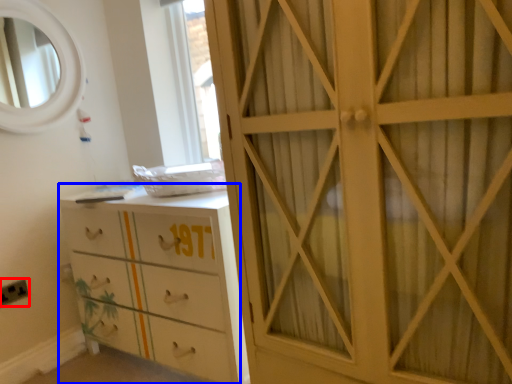
Question: Which object appears farthest to the camera in this image, electric outlet (highlighted by a red box) or chest of drawers (highlighted by a blue box)?

Choices:
 (A) electric outlet
 (B) chest of drawers

Answer: (A)